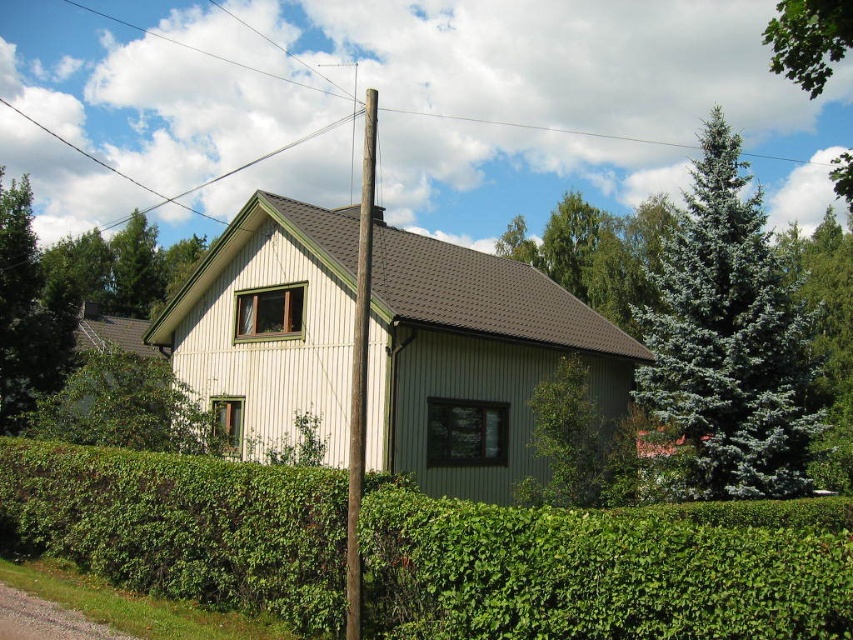
Question: Which point is closer to the camera?

Choices:
 (A) (585, 528)
 (B) (790, 468)

Answer: (A)

Question: Observing the image, what is the correct spatial positioning of green leafy hedge at center in reference to green leafy tree at upper left?

Choices:
 (A) right
 (B) left

Answer: (A)

Question: Among these points, which one is farthest from the camera?

Choices:
 (A) (196, 404)
 (B) (136, 310)
 (C) (4, 317)
 (D) (788, 74)

Answer: (B)

Question: Can you confirm if blue-green coniferous tree at right is positioned to the left of green leafy tree at upper right?

Choices:
 (A) yes
 (B) no

Answer: (A)

Question: Is green leafy tree at upper right to the left of green textured tree at upper left from the viewer's perspective?

Choices:
 (A) no
 (B) yes

Answer: (A)

Question: Which of the following is the farthest from the observer?

Choices:
 (A) green leafy tree at upper right
 (B) green leafy bush at lower left
 (C) blue-green coniferous tree at right

Answer: (C)